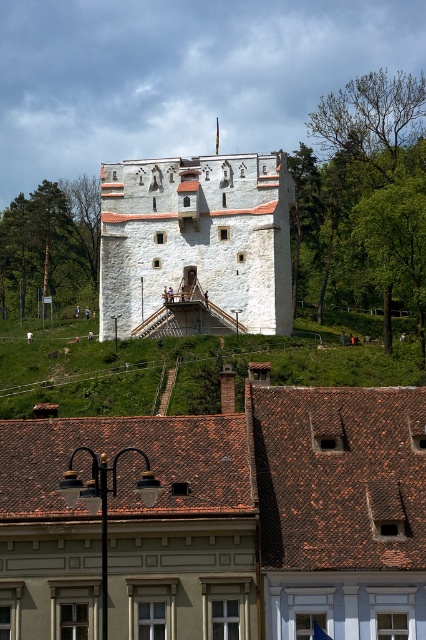
You are standing at the base of the hill and want to take a photo of the white stone tower at center and the green leafy tree at left. Which object should you focus on first to ensure both are in the frame?

You should focus on the white stone tower at center first because it is in front of the green leafy tree at left, so positioning the camera to include the tower will naturally include the tree behind it in the frame.

You are standing at the base of the large white stone tower and want to take a photo of the point at coordinates point (181,240). If your camera has a maximum zoom range of 100 meters, will you be able to capture the point clearly in your photo?

The point at coordinates point (181,240) is 125.74 meters away from the camera. Since the camera can only zoom up to 100 meters, it will not be able to capture the point clearly.

You are standing at the base of the tower and looking up at the two points marked in the image. Which point, point (423, 314) or point (98, 195), appears closer to you?

Point (423, 314) is closer to the camera than point (98, 195), so it appears closer to you.